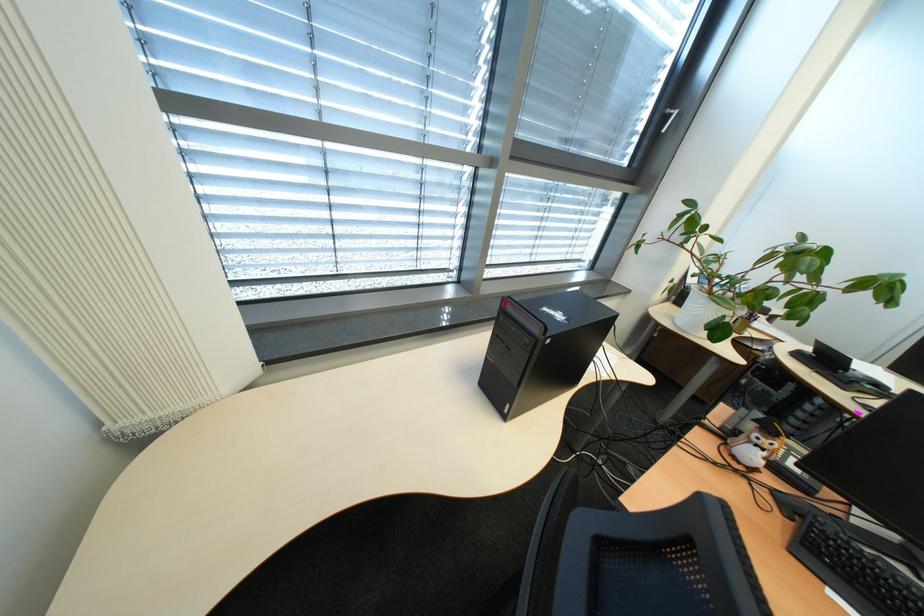
The height and width of the screenshot is (616, 924). What are the coordinates of `silver window handle` in the screenshot? It's located at (669, 119).